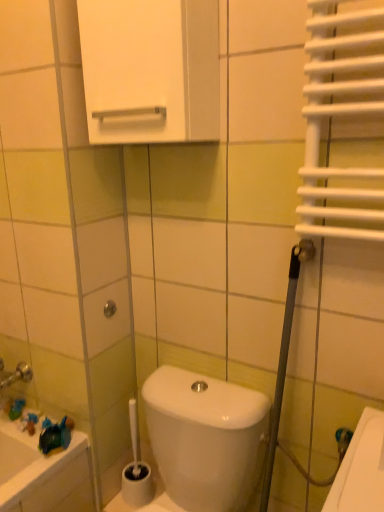
The width and height of the screenshot is (384, 512). I want to click on white plastic toilet brush at lower center, so click(x=136, y=469).

What is the approximate height of white plastic toilet brush at lower center?

white plastic toilet brush at lower center is 14.61 inches in height.

Find the location of a particular element. The height and width of the screenshot is (512, 384). metallic silver shower at center is located at coordinates (109, 308).

Is white plastic toilet brush at lower center not near white glossy cabinet at upper center?

Yes.

From the image's perspective, which one is positioned lower, white plastic toilet brush at lower center or white glossy cabinet at upper center?

white plastic toilet brush at lower center, from the image's perspective.

Can you tell me how much white plastic toilet brush at lower center and white glossy cabinet at upper center differ in facing direction?

There is a 1.14-degree angle between the facing directions of white plastic toilet brush at lower center and white glossy cabinet at upper center.

Is the position of white plastic toilet brush at lower center less distant than that of white glossy cabinet at upper center?

No, white plastic toilet brush at lower center is behind white glossy cabinet at upper center.

Between point (88, 2) and point (137, 465), which one is positioned behind?

Positioned behind is point (137, 465).

From a real-world perspective, is white glossy cabinet at upper center over white plastic toilet brush at lower center?

Yes, from a real-world perspective, white glossy cabinet at upper center is over white plastic toilet brush at lower center

From the image's perspective, between white glossy cabinet at upper center and white plastic toilet brush at lower center, who is located below?

From the image's view, white plastic toilet brush at lower center is below.

What's the angular difference between white glossy cabinet at upper center and white plastic toilet brush at lower center's facing directions?

The angle between the facing direction of white glossy cabinet at upper center and the facing direction of white plastic toilet brush at lower center is 1.14 degrees.

Which is closer to the camera, (135, 503) or (106, 312)?

Point (106, 312)

Is white plastic toilet brush at lower center not close to metallic silver shower at center?

white plastic toilet brush at lower center is near metallic silver shower at center, not far away.

Considering the relative sizes of white plastic toilet brush at lower center and metallic silver shower at center in the image provided, is white plastic toilet brush at lower center thinner than metallic silver shower at center?

No, white plastic toilet brush at lower center is not thinner than metallic silver shower at center.

From a real-world perspective, is white plastic toilet brush at lower center below metallic silver shower at center?

Correct, in the physical world, white plastic toilet brush at lower center is lower than metallic silver shower at center.

Is metallic silver shower at center next to white glossy cabinet at upper center and touching it?

There is a gap between metallic silver shower at center and white glossy cabinet at upper center.

Is metallic silver shower at center positioned with its back to white glossy cabinet at upper center?

metallic silver shower at center is not turned away from white glossy cabinet at upper center.

From the image's perspective, would you say metallic silver shower at center is shown under white glossy cabinet at upper center?

Yes, from the image's perspective, metallic silver shower at center is below white glossy cabinet at upper center.

Would you say white glossy cabinet at upper center is a long distance from metallic silver shower at center?

No, white glossy cabinet at upper center is not far away from metallic silver shower at center.

Is white glossy cabinet at upper center facing towards metallic silver shower at center?

No, white glossy cabinet at upper center is not oriented towards metallic silver shower at center.

Would you say white glossy cabinet at upper center is inside or outside metallic silver shower at center?

white glossy cabinet at upper center is spatially situated outside metallic silver shower at center.

Is white glossy cabinet at upper center at the right side of metallic silver shower at center?

Yes.

Would you consider metallic silver shower at center to be distant from white plastic toilet brush at lower center?

Actually, metallic silver shower at center and white plastic toilet brush at lower center are a little close together.

Based on the photo, who is shorter, metallic silver shower at center or white plastic toilet brush at lower center?

With less height is metallic silver shower at center.

Is metallic silver shower at center oriented away from white plastic toilet brush at lower center?

No, metallic silver shower at center is not facing the opposite direction of white plastic toilet brush at lower center.

Does metallic silver shower at center come in front of white plastic toilet brush at lower center?

No, it is not.

The image size is (384, 512). Identify the location of brush beneath the white glossy cabinet at upper center (from a real-world perspective). (136, 469).

Locate an element on the screen. medicine cabinet above the white plastic toilet brush at lower center (from a real-world perspective) is located at coordinates (150, 70).

From the picture: Looking at the image, which one is located closer to white plastic toilet brush at lower center, white glossy cabinet at upper center or metallic silver shower at center?

The object closer to white plastic toilet brush at lower center is metallic silver shower at center.

When comparing their distances from white glossy cabinet at upper center, does white plastic toilet brush at lower center or metallic silver shower at center seem closer?

Among the two, metallic silver shower at center is located nearer to white glossy cabinet at upper center.

Based on their spatial positions, is metallic silver shower at center or white glossy cabinet at upper center further from white plastic toilet brush at lower center?

white glossy cabinet at upper center is positioned further to the anchor white plastic toilet brush at lower center.

In the scene shown: When comparing their distances from metallic silver shower at center, does white glossy cabinet at upper center or white plastic toilet brush at lower center seem further?

Among the two, white glossy cabinet at upper center is located further to metallic silver shower at center.

Looking at the image, which one is located closer to white glossy cabinet at upper center, metallic silver shower at center or white plastic toilet brush at lower center?

metallic silver shower at center is positioned closer to the anchor white glossy cabinet at upper center.

Based on their spatial positions, is white plastic toilet brush at lower center or white glossy cabinet at upper center closer to metallic silver shower at center?

white plastic toilet brush at lower center is closer to metallic silver shower at center.

This screenshot has height=512, width=384. Find the location of `shower between white glossy cabinet at upper center and white plastic toilet brush at lower center from top to bottom`. shower between white glossy cabinet at upper center and white plastic toilet brush at lower center from top to bottom is located at coordinates (109, 308).